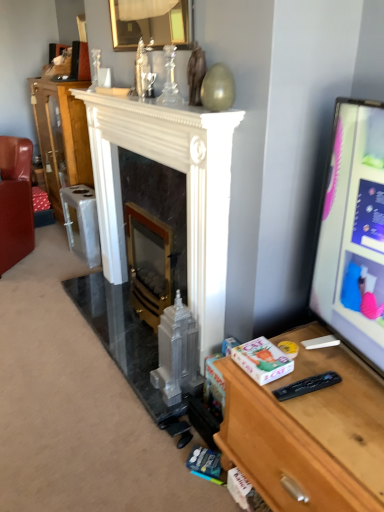
Question: Would you consider leather couch at left to be distant from wooden desk at right?

Choices:
 (A) no
 (B) yes

Answer: (B)

Question: From the image's perspective, would you say leather couch at left is positioned over wooden desk at right?

Choices:
 (A) no
 (B) yes

Answer: (B)

Question: Considering the relative sizes of leather couch at left and wooden desk at right in the image provided, is leather couch at left taller than wooden desk at right?

Choices:
 (A) no
 (B) yes

Answer: (B)

Question: Considering the relative positions of leather couch at left and wooden desk at right in the image provided, is leather couch at left to the left of wooden desk at right from the viewer's perspective?

Choices:
 (A) no
 (B) yes

Answer: (B)

Question: Is leather couch at left bigger than wooden desk at right?

Choices:
 (A) no
 (B) yes

Answer: (B)

Question: Is leather couch at left taller or shorter than wooden desk at right?

Choices:
 (A) short
 (B) tall

Answer: (B)

Question: From a real-world perspective, relative to wooden desk at right, is leather couch at left vertically above or below?

Choices:
 (A) above
 (B) below

Answer: (A)

Question: Is leather couch at left bigger or smaller than wooden desk at right?

Choices:
 (A) big
 (B) small

Answer: (A)

Question: Is leather couch at left inside or outside of wooden desk at right?

Choices:
 (A) inside
 (B) outside

Answer: (B)

Question: From a real-world perspective, is white marble fireplace at center, acting as the second fireplace starting from the right, above or below white marble fireplace at center?

Choices:
 (A) above
 (B) below

Answer: (B)

Question: Is white marble fireplace at center, arranged as the 1th fireplace when viewed from the left, taller or shorter than white marble fireplace at center?

Choices:
 (A) short
 (B) tall

Answer: (A)

Question: Relative to white marble fireplace at center, is white marble fireplace at center, arranged as the 1th fireplace when viewed from the left, in front or behind?

Choices:
 (A) front
 (B) behind

Answer: (A)

Question: From the image's perspective, is white marble fireplace at center, arranged as the 1th fireplace when viewed from the left, located above or below white marble fireplace at center?

Choices:
 (A) above
 (B) below

Answer: (B)

Question: Which is correct: white marble fireplace at center, acting as the second fireplace starting from the right, is inside wooden desk at right, or outside of it?

Choices:
 (A) inside
 (B) outside

Answer: (B)

Question: In terms of width, does white marble fireplace at center, acting as the second fireplace starting from the right, look wider or thinner when compared to wooden desk at right?

Choices:
 (A) wide
 (B) thin

Answer: (B)